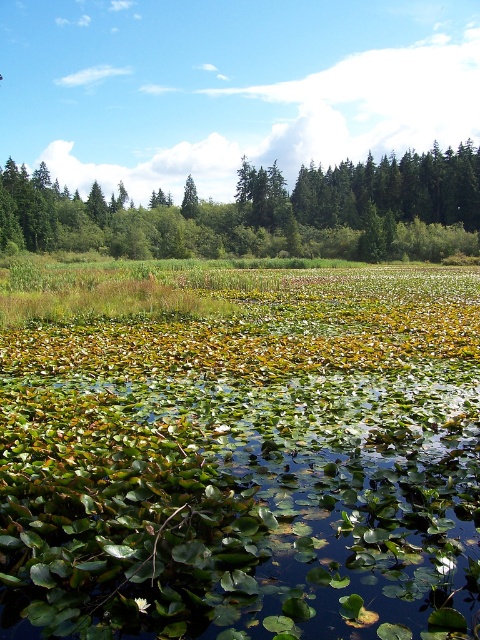
Does green leafy water at center have a smaller size compared to green leafy tree at left?

Indeed, green leafy water at center has a smaller size compared to green leafy tree at left.

Does green leafy water at center appear under green leafy tree at left?

Yes, green leafy water at center is below green leafy tree at left.

Is point (3, 524) positioned in front of point (144, 250)?

Yes, point (3, 524) is closer to viewer.

Find the location of a particular element. green leafy water at center is located at coordinates (241, 506).

Which is behind, point (218, 579) or point (192, 216)?

Point (192, 216)

Is point (46, 401) positioned in front of point (196, 198)?

Yes, it is in front of point (196, 198).

Between point (90, 410) and point (192, 198), which one is positioned behind?

The point (192, 198) is behind.

In order to click on green leafy water at center in this screenshot , I will do click(x=241, y=506).

Does green leafy tree at left appear under green matte tree at center?

Correct, green leafy tree at left is located below green matte tree at center.

Who is more forward, (245,228) or (189,211)?

Point (245,228)

At what (x,y) coordinates should I click in order to perform the action: click on green leafy tree at left. Please return your answer as a coordinate pair (x, y). This screenshot has width=480, height=640. Looking at the image, I should click on (264, 212).